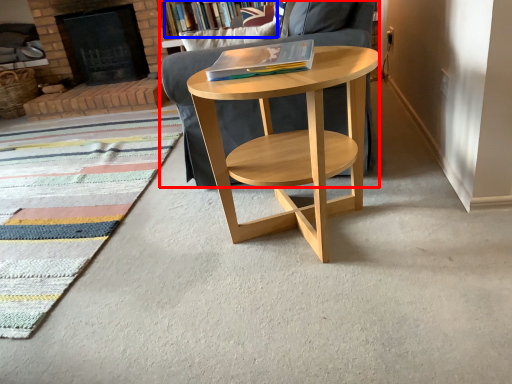
Question: Which object appears closest to the camera in this image, chair (highlighted by a red box) or bookcase (highlighted by a blue box)?

Choices:
 (A) chair
 (B) bookcase

Answer: (A)